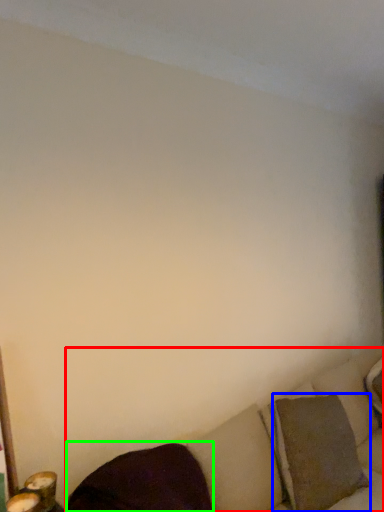
Question: Considering the real-world distances, which object is farthest from studio couch (highlighted by a red box)? pillow (highlighted by a blue box) or pillow (highlighted by a green box)?

Choices:
 (A) pillow
 (B) pillow

Answer: (B)